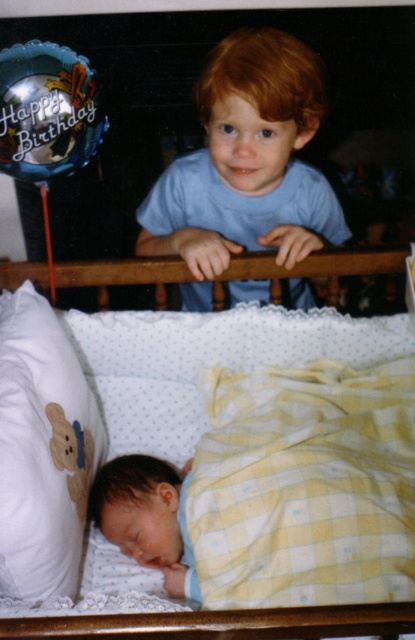
Can you confirm if yellow checkered blanket at lower center is positioned below yellow checkered blanket at center?

Yes, yellow checkered blanket at lower center is below yellow checkered blanket at center.

Between yellow checkered blanket at lower center and yellow checkered blanket at center, which one is positioned higher?

yellow checkered blanket at center is above.

Image resolution: width=415 pixels, height=640 pixels. Find the location of `yellow checkered blanket at lower center`. yellow checkered blanket at lower center is located at coordinates (305, 486).

Does blue cotton shirt at upper center have a greater height compared to yellow checkered blanket at center?

Indeed, blue cotton shirt at upper center has a greater height compared to yellow checkered blanket at center.

Which is more to the left, blue cotton shirt at upper center or yellow checkered blanket at center?

From the viewer's perspective, yellow checkered blanket at center appears more on the left side.

Is point (244, 106) positioned in front of point (373, 268)?

Yes, point (244, 106) is in front of point (373, 268).

Locate an element on the screen. The width and height of the screenshot is (415, 640). blue cotton shirt at upper center is located at coordinates (248, 163).

Is white soft pillow at lower left below yellow checkered blanket at center?

Yes, white soft pillow at lower left is below yellow checkered blanket at center.

Describe the element at coordinates (43, 451) in the screenshot. I see `white soft pillow at lower left` at that location.

Locate an element on the screen. white soft pillow at lower left is located at coordinates (43, 451).